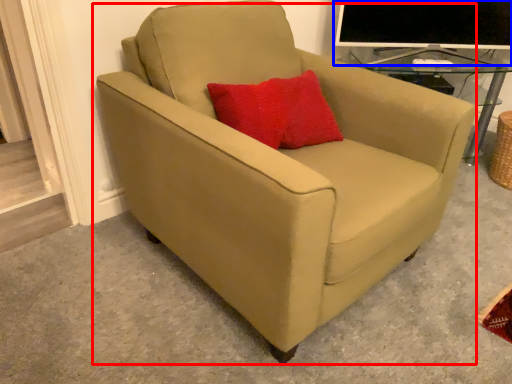
Question: Which object is closer to the camera taking this photo, chair (highlighted by a red box) or computer monitor (highlighted by a blue box)?

Choices:
 (A) chair
 (B) computer monitor

Answer: (A)